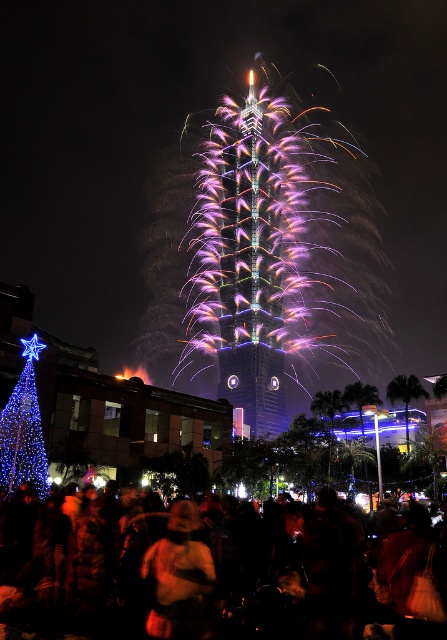
Question: Does matte gold helmet at center have a larger size compared to blue illuminated christmas tree at left?

Choices:
 (A) no
 (B) yes

Answer: (B)

Question: Observing the image, what is the correct spatial positioning of dark clothing crowd at lower center in reference to matte gold helmet at center?

Choices:
 (A) left
 (B) right

Answer: (B)

Question: Which point is closer to the camera taking this photo?

Choices:
 (A) (148, 625)
 (B) (79, 545)

Answer: (A)

Question: Which point is closer to the camera?

Choices:
 (A) matte gold helmet at center
 (B) blue illuminated christmas tree at left

Answer: (A)

Question: Is dark clothing crowd at lower center to the right of matte gold helmet at center from the viewer's perspective?

Choices:
 (A) yes
 (B) no

Answer: (A)

Question: Which point is farther to the camera?

Choices:
 (A) dark clothing crowd at lower center
 (B) blue illuminated christmas tree at left
 (C) matte gold helmet at center

Answer: (B)